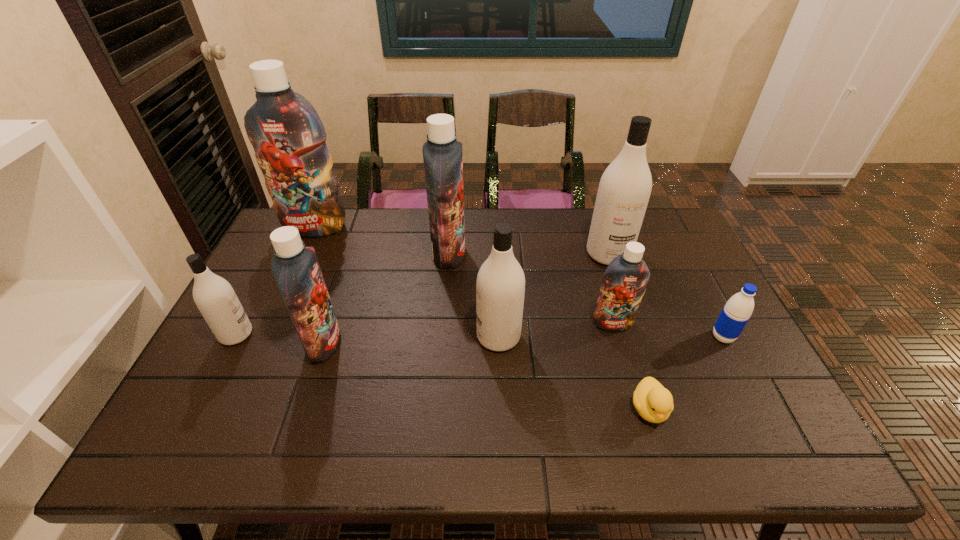
Locate an element on the screen. free space that satisfies the following two spatial constraints: 1. on the front label of the water bottle; 2. on the left side of the tallest shampoo is located at coordinates (265, 337).

Find the location of a particular element. vacant point that satisfies the following two spatial constraints: 1. on the front-facing side of the leftmost white shampoo; 2. on the right side of the blue water bottle is located at coordinates (235, 337).

This screenshot has height=540, width=960. What are the coordinates of `free location that satisfies the following two spatial constraints: 1. on the back side of the water bottle; 2. on the front label of the second biggest blue shampoo` in the screenshot? It's located at (x=680, y=253).

You are a GUI agent. You are given a task and a screenshot of the screen. Output one action in this format:
    pyautogui.click(x=<x>, y=<y>)
    Task: Click on the free space that satisfies the following two spatial constraints: 1. on the front label of the water bottle; 2. on the right side of the third smallest blue shampoo
    This screenshot has height=540, width=960.
    Given the screenshot: What is the action you would take?
    pyautogui.click(x=443, y=337)

The image size is (960, 540). In order to click on free space that satisfies the following two spatial constraints: 1. on the front label of the rightmost blue shampoo; 2. on the front label of the second blue shampoo from left to right in this screenshot , I will do tap(618, 343).